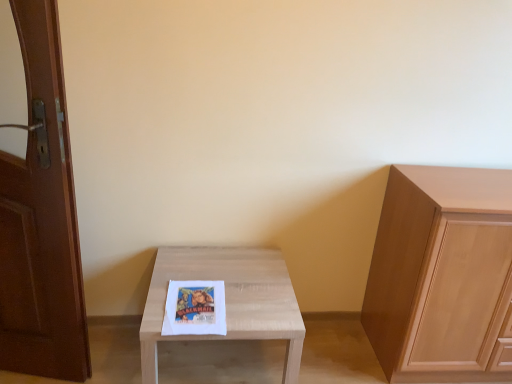
Question: Can light wood cabinet at right be found inside brown wooden door at left?

Choices:
 (A) yes
 (B) no

Answer: (B)

Question: Is brown wooden door at left not near light wood cabinet at right?

Choices:
 (A) no
 (B) yes

Answer: (B)

Question: Can you confirm if brown wooden door at left is bigger than light wood cabinet at right?

Choices:
 (A) yes
 (B) no

Answer: (B)

Question: Does brown wooden door at left lie behind light wood cabinet at right?

Choices:
 (A) no
 (B) yes

Answer: (A)

Question: Considering the relative sizes of brown wooden door at left and light wood cabinet at right in the image provided, is brown wooden door at left smaller than light wood cabinet at right?

Choices:
 (A) yes
 (B) no

Answer: (A)

Question: Considering the positions of light wood table at center and light wood cabinet at right in the image, is light wood table at center wider or thinner than light wood cabinet at right?

Choices:
 (A) thin
 (B) wide

Answer: (B)

Question: Would you say light wood table at center is inside or outside light wood cabinet at right?

Choices:
 (A) outside
 (B) inside

Answer: (A)

Question: Considering their positions, is light wood table at center located in front of or behind light wood cabinet at right?

Choices:
 (A) behind
 (B) front

Answer: (B)

Question: Is point (273, 301) positioned closer to the camera than point (475, 311)?

Choices:
 (A) closer
 (B) farther

Answer: (A)

Question: Is point (497, 379) closer or farther from the camera than point (227, 317)?

Choices:
 (A) closer
 (B) farther

Answer: (B)

Question: Visually, is light wood cabinet at right positioned to the left or to the right of light wood table at center?

Choices:
 (A) right
 (B) left

Answer: (A)

Question: In terms of height, does light wood cabinet at right look taller or shorter compared to light wood table at center?

Choices:
 (A) short
 (B) tall

Answer: (B)

Question: From the image's perspective, is light wood cabinet at right located above or below light wood table at center?

Choices:
 (A) below
 (B) above

Answer: (B)

Question: Considering their positions, is brown wooden door at left located in front of or behind light wood table at center?

Choices:
 (A) front
 (B) behind

Answer: (A)

Question: In terms of size, does brown wooden door at left appear bigger or smaller than light wood table at center?

Choices:
 (A) big
 (B) small

Answer: (B)